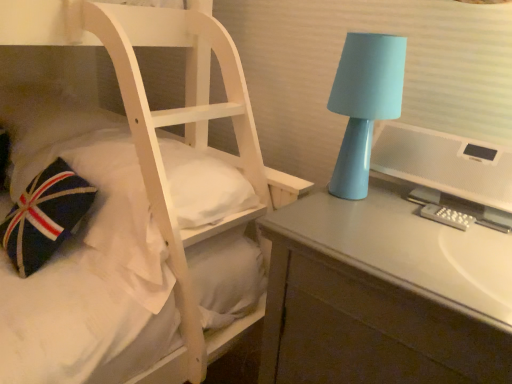
Question: Can you confirm if matte gray desk at right is thinner than matte blue lamp at right?

Choices:
 (A) yes
 (B) no

Answer: (B)

Question: Does matte gray desk at right have a larger size compared to matte blue lamp at right?

Choices:
 (A) no
 (B) yes

Answer: (B)

Question: Can you confirm if matte gray desk at right is shorter than matte blue lamp at right?

Choices:
 (A) yes
 (B) no

Answer: (B)

Question: From the image's perspective, is matte gray desk at right beneath matte blue lamp at right?

Choices:
 (A) yes
 (B) no

Answer: (A)

Question: Can you confirm if matte gray desk at right is positioned to the left of matte blue lamp at right?

Choices:
 (A) yes
 (B) no

Answer: (B)

Question: From a real-world perspective, is matte gray desk at right physically located above or below matte blue lamp at right?

Choices:
 (A) below
 (B) above

Answer: (A)

Question: Is matte gray desk at right taller or shorter than matte blue lamp at right?

Choices:
 (A) tall
 (B) short

Answer: (A)

Question: Relative to matte blue lamp at right, is matte gray desk at right in front or behind?

Choices:
 (A) front
 (B) behind

Answer: (A)

Question: Which is correct: matte gray desk at right is inside matte blue lamp at right, or outside of it?

Choices:
 (A) outside
 (B) inside

Answer: (A)

Question: Considering the positions of white textured computer monitor at right and matte gray desk at right in the image, is white textured computer monitor at right wider or thinner than matte gray desk at right?

Choices:
 (A) wide
 (B) thin

Answer: (B)

Question: Considering the positions of white textured computer monitor at right and matte gray desk at right in the image, is white textured computer monitor at right bigger or smaller than matte gray desk at right?

Choices:
 (A) big
 (B) small

Answer: (B)

Question: From a real-world perspective, is white textured computer monitor at right above or below matte gray desk at right?

Choices:
 (A) above
 (B) below

Answer: (A)

Question: Is white textured computer monitor at right inside or outside of matte gray desk at right?

Choices:
 (A) inside
 (B) outside

Answer: (B)

Question: From a real-world perspective, relative to white textured computer monitor at right, is matte gray desk at right vertically above or below?

Choices:
 (A) below
 (B) above

Answer: (A)

Question: Considering the positions of matte gray desk at right and white textured computer monitor at right in the image, is matte gray desk at right wider or thinner than white textured computer monitor at right?

Choices:
 (A) wide
 (B) thin

Answer: (A)